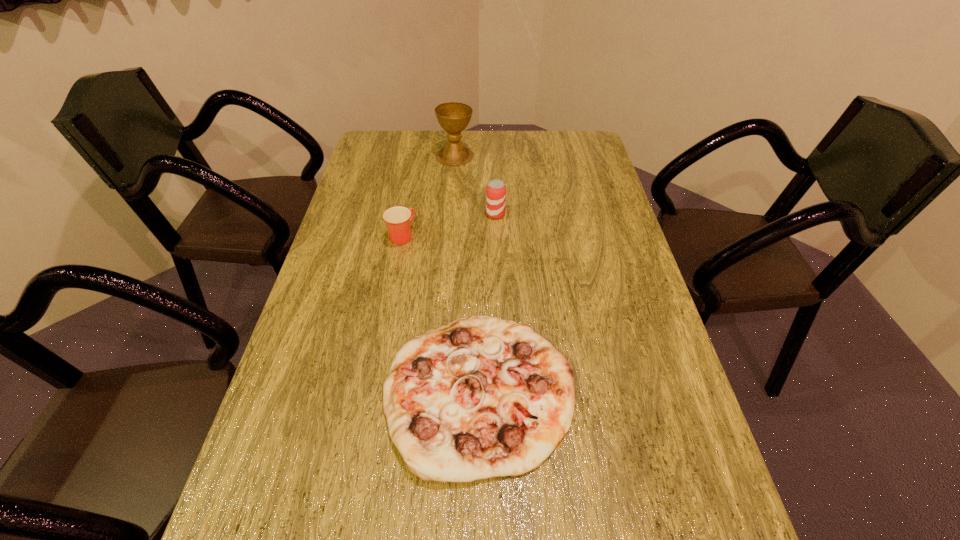
This screenshot has width=960, height=540. I want to click on the farthest object, so [453, 117].

The image size is (960, 540). Identify the location of the tallest object. (453, 117).

You are a GUI agent. You are given a task and a screenshot of the screen. Output one action in this format:
    pyautogui.click(x=<x>, y=<y>)
    Task: Click on the second tallest object
    
    Given the screenshot: What is the action you would take?
    pyautogui.click(x=495, y=191)

Find the location of a particular element. the second farthest object is located at coordinates (495, 191).

The width and height of the screenshot is (960, 540). In order to click on cup in this screenshot , I will do `click(398, 219)`.

The width and height of the screenshot is (960, 540). Identify the location of the second shortest object. (398, 219).

In order to click on pizza in this screenshot , I will do coord(481,397).

Where is `the nearest object`? This screenshot has width=960, height=540. the nearest object is located at coordinates (481, 397).

The width and height of the screenshot is (960, 540). What are the coordinates of `vacant space located 0.080m on the back of the farthest object` in the screenshot? It's located at (x=456, y=135).

Where is `vacant region located 0.160m on the front of the second tallest object`? The width and height of the screenshot is (960, 540). vacant region located 0.160m on the front of the second tallest object is located at coordinates (497, 256).